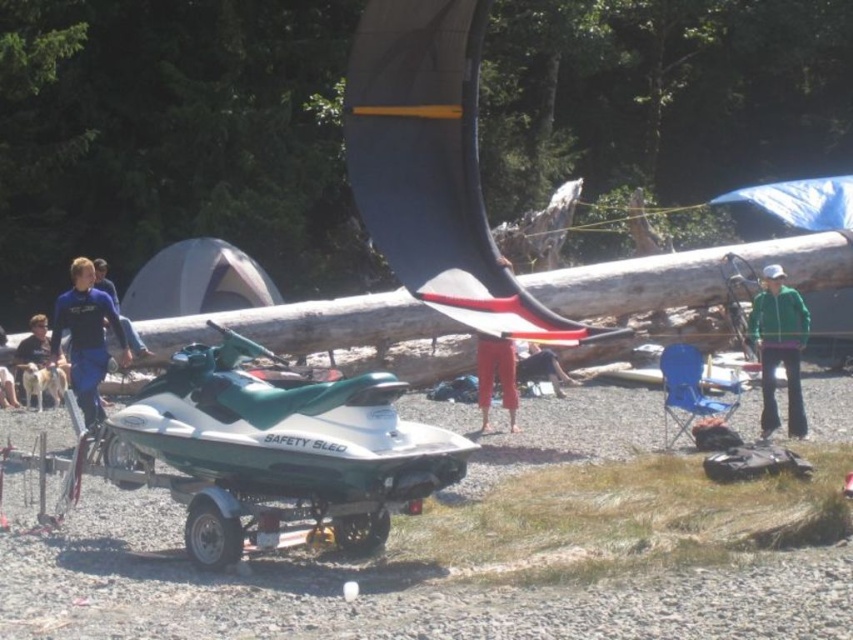
Which is behind, point (56, 321) or point (44, 326)?

The point (44, 326) is behind.

Which of these two, blue wetsuit at left or dark blue wetsuit at lower left, stands shorter?

With less height is dark blue wetsuit at lower left.

Is point (61, 305) farther from camera compared to point (44, 320)?

That is False.

Locate an element on the screen. This screenshot has width=853, height=640. blue wetsuit at left is located at coordinates (86, 337).

Can you confirm if green fleece jacket at right is positioned above red cotton pants at center?

Indeed, green fleece jacket at right is positioned over red cotton pants at center.

Is point (769, 284) less distant than point (512, 404)?

That is True.

This screenshot has height=640, width=853. What are the coordinates of `green fleece jacket at right` in the screenshot? It's located at (779, 348).

Based on the photo, between green fleece jacket at right and dark blue wetsuit at lower left, which one has more height?

green fleece jacket at right is taller.

This screenshot has width=853, height=640. What do you see at coordinates (779, 348) in the screenshot? I see `green fleece jacket at right` at bounding box center [779, 348].

Find the location of a particular element. Image resolution: width=853 pixels, height=640 pixels. green fleece jacket at right is located at coordinates (779, 348).